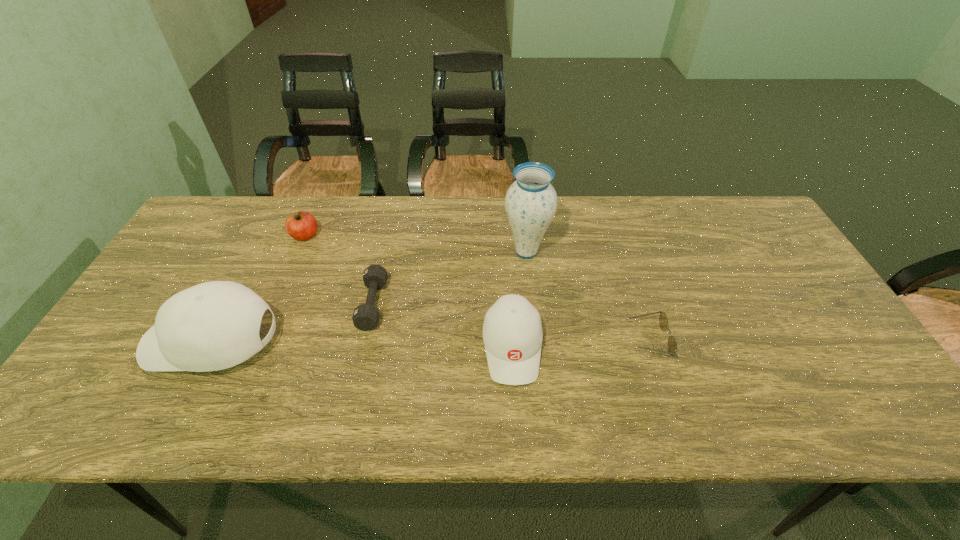
You are a GUI agent. You are given a task and a screenshot of the screen. Output one action in this format:
    pyautogui.click(x=<x>, y=<y>)
    Task: Click on the free spot between the dumbbell and the vase
    
    Given the screenshot: What is the action you would take?
    (x=449, y=278)

At what (x,y) coordinates should I click in order to perform the action: click on vacant region between the fifth shortest object and the fourth tallest object. Please return your answer as a coordinate pair (x, y). Looking at the image, I should click on (259, 289).

Where is `blank region between the shorter baseball cap and the left baseball cap`? Image resolution: width=960 pixels, height=540 pixels. blank region between the shorter baseball cap and the left baseball cap is located at coordinates point(363,345).

The image size is (960, 540). I want to click on blank region between the apple and the dumbbell, so click(x=339, y=270).

Where is `blank region between the tallest object and the third object from left to right`? This screenshot has height=540, width=960. blank region between the tallest object and the third object from left to right is located at coordinates (449, 278).

Select which object appears as the fourth closest to the vase. Please provide its 2D coordinates. Your answer should be formatted as a tuple, i.e. [(x, y)], where the tuple contains the x and y coordinates of a point satisfying the conditions above.

[(301, 225)]

Where is `object that stands as the second closest to the dumbbell`? Image resolution: width=960 pixels, height=540 pixels. object that stands as the second closest to the dumbbell is located at coordinates (301, 225).

You are a GUI agent. You are given a task and a screenshot of the screen. Output one action in this format:
    pyautogui.click(x=<x>, y=<y>)
    Task: Click on the vacant space that satisfies the following two spatial constraints: 1. on the back side of the fourth object from right to left; 2. on the left side of the vase
    
    Given the screenshot: What is the action you would take?
    pyautogui.click(x=384, y=252)

Image resolution: width=960 pixels, height=540 pixels. I want to click on free space that satisfies the following two spatial constraints: 1. on the front-facing side of the spectacles; 2. on the front-facing side of the fourth shortest object, so click(650, 348).

Where is `vacant space that satisfies the following two spatial constraints: 1. on the front side of the fourth tallest object; 2. on the front-facing side of the taller baseball cap`? vacant space that satisfies the following two spatial constraints: 1. on the front side of the fourth tallest object; 2. on the front-facing side of the taller baseball cap is located at coordinates (260, 342).